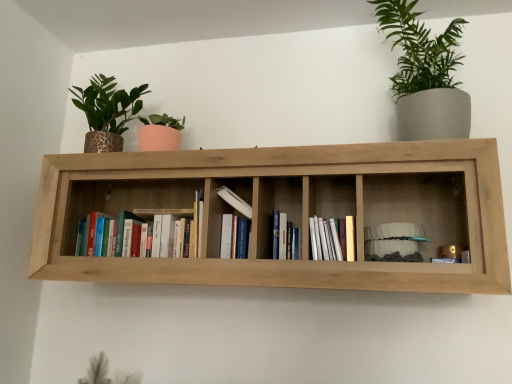
Question: Can you confirm if hardcover books at center, which ranks as the fifth book in right-to-left order, is smaller than white paper at center, which ranks as the second book in right-to-left order?

Choices:
 (A) yes
 (B) no

Answer: (B)

Question: Considering the relative positions of hardcover books at center, which ranks as the fifth book in right-to-left order, and white paper at center, positioned as the fourth book in left-to-right order, in the image provided, is hardcover books at center, which ranks as the fifth book in right-to-left order, to the right of white paper at center, positioned as the fourth book in left-to-right order, from the viewer's perspective?

Choices:
 (A) yes
 (B) no

Answer: (B)

Question: Is hardcover books at center, which ranks as the fifth book in right-to-left order, facing away from white paper at center, positioned as the fourth book in left-to-right order?

Choices:
 (A) no
 (B) yes

Answer: (A)

Question: Does hardcover books at center, the first book positioned from the left, have a greater width compared to white paper at center, which ranks as the second book in right-to-left order?

Choices:
 (A) no
 (B) yes

Answer: (A)

Question: Is hardcover books at center, which ranks as the fifth book in right-to-left order, beside white paper at center, positioned as the fourth book in left-to-right order?

Choices:
 (A) yes
 (B) no

Answer: (B)

Question: In the image, is white matte stack of plates at right, arranged as the 5th book when viewed from the left, positioned in front of or behind white paper at center, positioned as the fourth book in left-to-right order?

Choices:
 (A) front
 (B) behind

Answer: (B)

Question: From their relative heights in the image, would you say white matte stack of plates at right, arranged as the 5th book when viewed from the left, is taller or shorter than white paper at center, positioned as the fourth book in left-to-right order?

Choices:
 (A) short
 (B) tall

Answer: (A)

Question: Considering the positions of point (376, 253) and point (325, 258), is point (376, 253) closer or farther from the camera than point (325, 258)?

Choices:
 (A) closer
 (B) farther

Answer: (B)

Question: Looking at their shapes, would you say white matte stack of plates at right, arranged as the 5th book when viewed from the left, is wider or thinner than white paper at center, which ranks as the second book in right-to-left order?

Choices:
 (A) thin
 (B) wide

Answer: (A)

Question: From the image's perspective, relative to hardcover books at center, the first book positioned from the left, is hardcover book at center, which is the 3th book in left-to-right order, above or below?

Choices:
 (A) below
 (B) above

Answer: (A)

Question: From a real-world perspective, is hardcover book at center, which is the 3th book in left-to-right order, positioned above or below hardcover books at center, the first book positioned from the left?

Choices:
 (A) above
 (B) below

Answer: (B)

Question: Choose the correct answer: Is hardcover book at center, marked as the third book in a right-to-left arrangement, inside hardcover books at center, the first book positioned from the left, or outside it?

Choices:
 (A) outside
 (B) inside

Answer: (A)

Question: Is point (282, 254) positioned closer to the camera than point (141, 213)?

Choices:
 (A) farther
 (B) closer

Answer: (B)

Question: Is natural wood shelf at center wider or thinner than hardcover book at center, which is the 3th book in left-to-right order?

Choices:
 (A) thin
 (B) wide

Answer: (B)

Question: In terms of size, does natural wood shelf at center appear bigger or smaller than hardcover book at center, which is the 3th book in left-to-right order?

Choices:
 (A) big
 (B) small

Answer: (A)